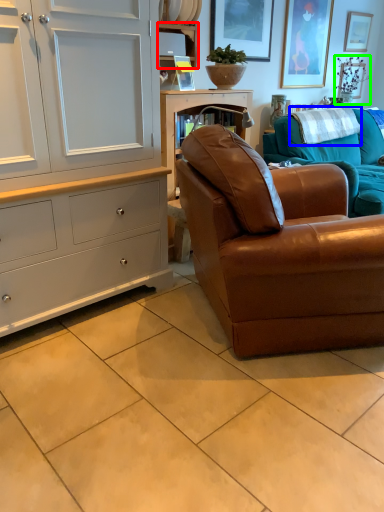
Question: Estimate the real-world distances between objects in this image. Which object is farther from shelf (highlighted by a red box), blanket (highlighted by a blue box) or plant (highlighted by a green box)?

Choices:
 (A) blanket
 (B) plant

Answer: (B)